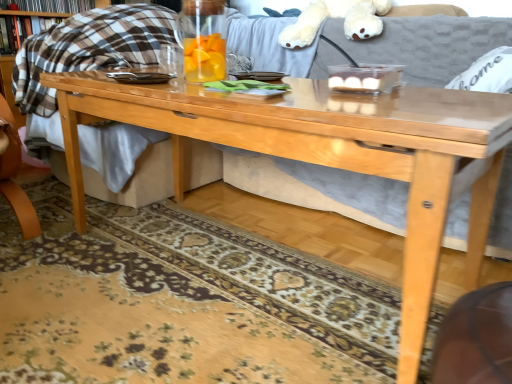
Where is `blank space situated above plaid fabric book at upper left, marked as the 1th book in a bottom-to-top arrangement (from a real-world perspective)`? blank space situated above plaid fabric book at upper left, marked as the 1th book in a bottom-to-top arrangement (from a real-world perspective) is located at coordinates (30, 12).